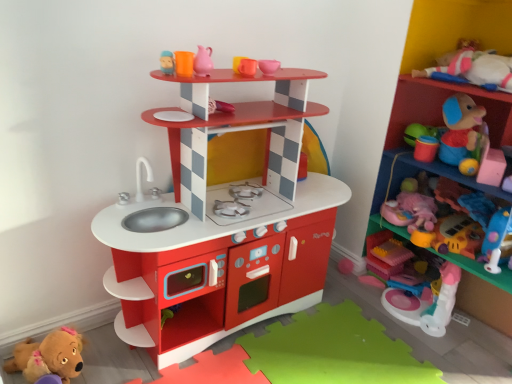
Question: Are pink rubber jug at upper center, positioned as the 2th toy in left-to-right order, and plastic toy at upper right, the 2th shelf viewed from the left, located far from each other?

Choices:
 (A) yes
 (B) no

Answer: (A)

Question: Is pink rubber jug at upper center, positioned as the 5th toy in bottom-to-top order, shorter than plastic toy at upper right, the 1th shelf positioned from the right?

Choices:
 (A) yes
 (B) no

Answer: (A)

Question: From the image's perspective, is pink rubber jug at upper center, placed as the 1th toy when sorted from top to bottom, under plastic toy at upper right, the 1th shelf positioned from the right?

Choices:
 (A) yes
 (B) no

Answer: (B)

Question: Is the depth of pink rubber jug at upper center, positioned as the 5th toy in bottom-to-top order, less than that of plastic toy at upper right, the 1th shelf positioned from the right?

Choices:
 (A) yes
 (B) no

Answer: (B)

Question: Can you confirm if pink rubber jug at upper center, positioned as the 2th toy in left-to-right order, is thinner than plastic toy at upper right, the 2th shelf viewed from the left?

Choices:
 (A) yes
 (B) no

Answer: (A)

Question: Does pink rubber jug at upper center, positioned as the 2th toy in left-to-right order, have a greater width compared to plastic toy at upper right, the 1th shelf positioned from the right?

Choices:
 (A) no
 (B) yes

Answer: (A)

Question: From a real-world perspective, is pink plush toy at right, the 5th toy viewed from the left, positioned over brown plush toy at lower left, the 1th toy when ordered from left to right, based on gravity?

Choices:
 (A) yes
 (B) no

Answer: (A)

Question: Does pink plush toy at right, the 4th toy from the bottom, have a greater width compared to brown plush toy at lower left, the 1th toy when ordered from left to right?

Choices:
 (A) yes
 (B) no

Answer: (A)

Question: From the image's perspective, is pink plush toy at right, the 4th toy from the bottom, located above brown plush toy at lower left, the 1th toy when ordered from left to right?

Choices:
 (A) yes
 (B) no

Answer: (A)

Question: Is brown plush toy at lower left, which ranks as the first toy in bottom-to-top order, inside pink plush toy at right, acting as the 1th toy starting from the right?

Choices:
 (A) no
 (B) yes

Answer: (A)

Question: Does pink plush toy at right, the 4th toy from the bottom, have a larger size compared to brown plush toy at lower left, which ranks as the first toy in bottom-to-top order?

Choices:
 (A) yes
 (B) no

Answer: (A)

Question: Is pink plush toy at right, acting as the 1th toy starting from the right, next to brown plush toy at lower left, which ranks as the first toy in bottom-to-top order?

Choices:
 (A) no
 (B) yes

Answer: (A)

Question: Is plastic toy at upper right, the 1th shelf positioned from the right, closer to camera compared to matte plastic shelf at upper center, which is counted as the first shelf, starting from the left?

Choices:
 (A) yes
 (B) no

Answer: (B)